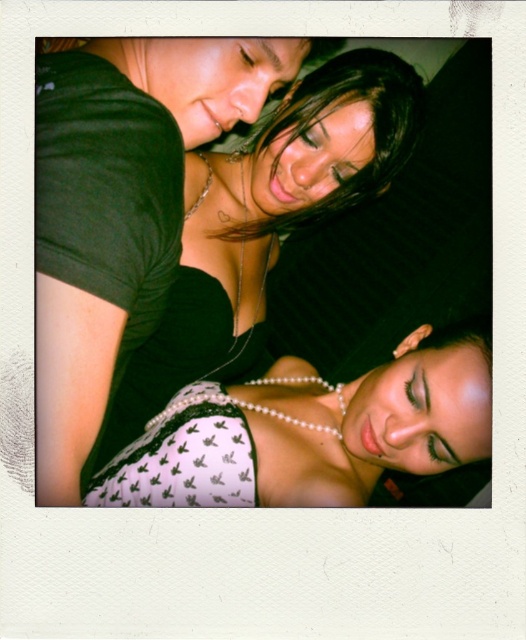
You are a photographer who wants to ensure the white lace bra at upper center and the shiny black hair at upper center are both visible in your close crop. Based on their sizes, which one will occupy more space in the photo?

The white lace bra at upper center has a larger size compared to the shiny black hair at upper center, so it will occupy more space in the photo.

You are a photographer trying to focus on the shiny black hair at upper center and the white lace top at lower center. Which object should you adjust your camera focus to first if you want to capture both in sharp detail?

You should focus on the shiny black hair at upper center first because it is further away from the viewer compared to the white lace top at lower center, which is closer. By focusing on the furthest object first, you can ensure both are in focus using depth of field.

In the image, there are a white lace top at lower center and a shiny black hair at upper center. Which object appears bigger in the photo?

The white lace top at lower center has a larger size compared to shiny black hair at upper center, so it appears bigger in the photo.